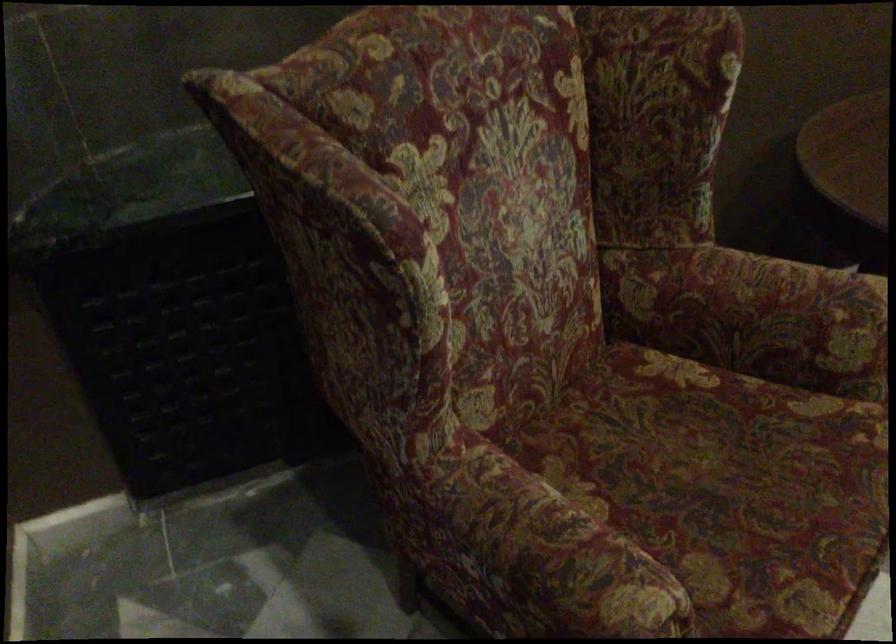
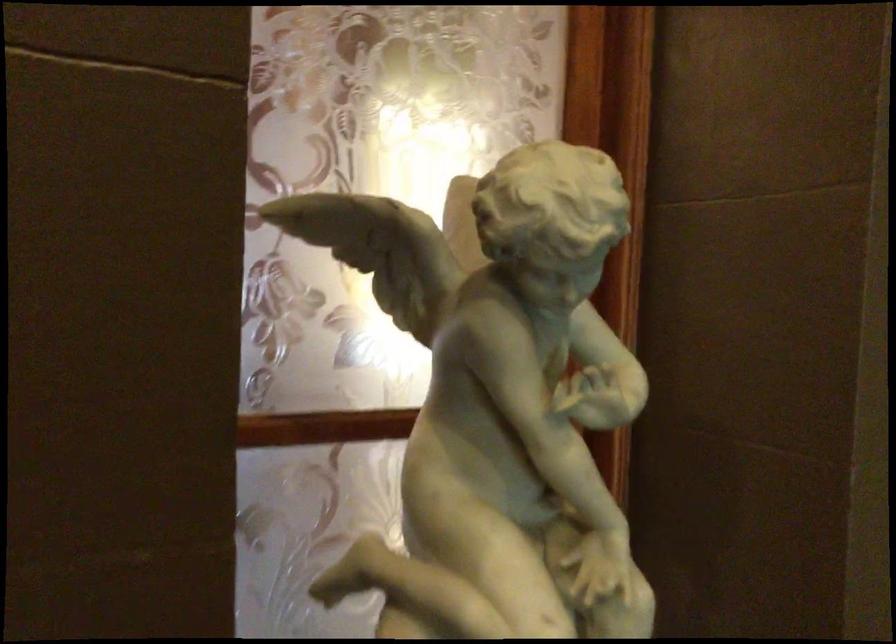
Question: How did the camera likely rotate?

Choices:
 (A) Left
 (B) Right
 (C) Up
 (D) Down

Answer: (A)